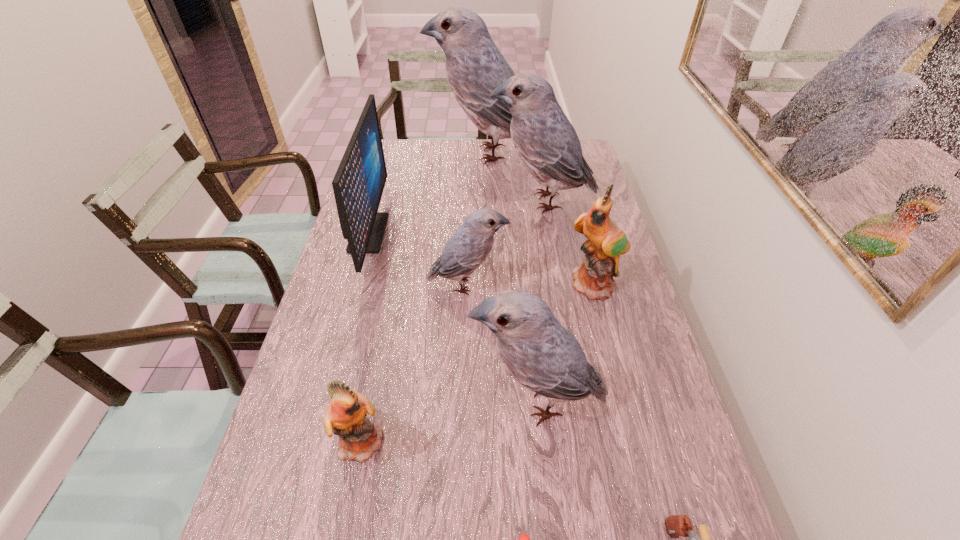
In the image, there is a desktop. What are the coordinates of `free space at the right edge` in the screenshot? It's located at (613, 295).

Identify the location of free area in between the right green parrot and the biggest gray parrot. This screenshot has width=960, height=540. click(x=540, y=219).

Locate an element on the screen. The width and height of the screenshot is (960, 540). free space between the leftmost object and the third farthest gray parrot is located at coordinates (418, 259).

At what (x,y) coordinates should I click in order to perform the action: click on free space between the bigger green parrot and the left green parrot. Please return your answer as a coordinate pair (x, y). Looking at the image, I should click on (479, 363).

Find the location of a particular element. Image resolution: width=960 pixels, height=540 pixels. unoccupied area between the nearer green parrot and the smallest gray parrot is located at coordinates [x=415, y=363].

Image resolution: width=960 pixels, height=540 pixels. Find the location of `unoccupied area between the third farthest gray parrot and the bigger green parrot`. unoccupied area between the third farthest gray parrot and the bigger green parrot is located at coordinates (531, 285).

Image resolution: width=960 pixels, height=540 pixels. What are the coordinates of `vacant area between the farthest object and the second tallest parrot` in the screenshot? It's located at (514, 177).

Point out which object is positioned as the third nearest to the computer monitor. Please provide its 2D coordinates. Your answer should be formatted as a tuple, i.e. [(x, y)], where the tuple contains the x and y coordinates of a point satisfying the conditions above.

[(545, 140)]

Select which object appears as the second closest to the nearest gray parrot. Please provide its 2D coordinates. Your answer should be formatted as a tuple, i.e. [(x, y)], where the tuple contains the x and y coordinates of a point satisfying the conditions above.

[(676, 525)]

Locate which parrot is the fifth closest to the third biggest gray parrot. Please provide its 2D coordinates. Your answer should be formatted as a tuple, i.e. [(x, y)], where the tuple contains the x and y coordinates of a point satisfying the conditions above.

[(474, 66)]